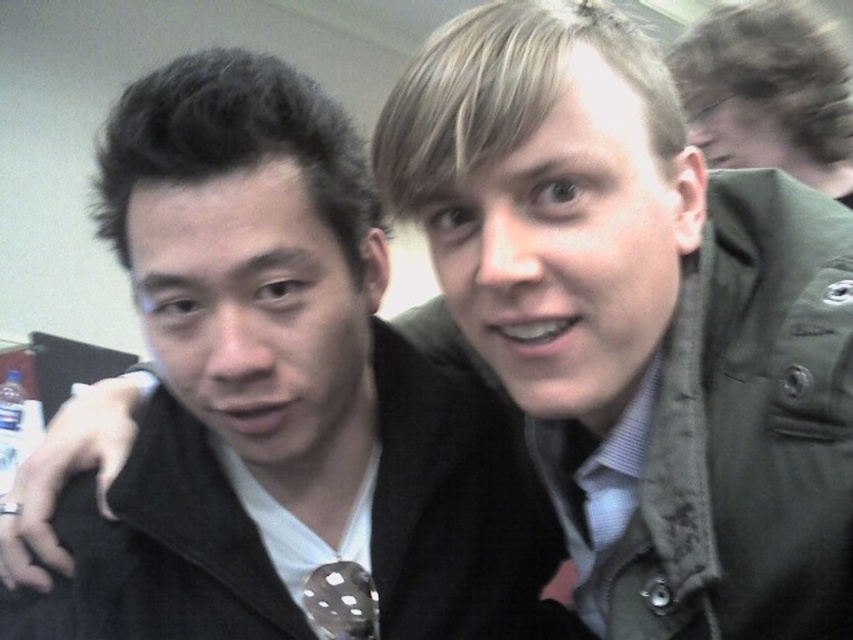
Locate an element on the screen. Image resolution: width=853 pixels, height=640 pixels. matte black jacket at center is located at coordinates (279, 396).

Between matte black jacket at center and white dotted fabric tie at center, which one has more height?

matte black jacket at center is taller.

Is point (248, 268) behind point (341, 605)?

That is False.

Identify the location of matte black jacket at center. This screenshot has height=640, width=853. (279, 396).

Looking at this image, can you confirm if matte black jacket at center is positioned to the left of dark green jacket at upper right?

Indeed, matte black jacket at center is positioned on the left side of dark green jacket at upper right.

Where is `matte black jacket at center`? matte black jacket at center is located at coordinates (279, 396).

Is point (802, 115) more distant than point (320, 580)?

Yes, point (802, 115) is farther from viewer.

Does dark green jacket at upper right have a greater height compared to white dotted fabric tie at center?

Correct, dark green jacket at upper right is much taller as white dotted fabric tie at center.

Who is more distant from viewer, (683, 70) or (357, 628)?

Point (683, 70)

Find the location of a particular element. dark green jacket at upper right is located at coordinates (767, 92).